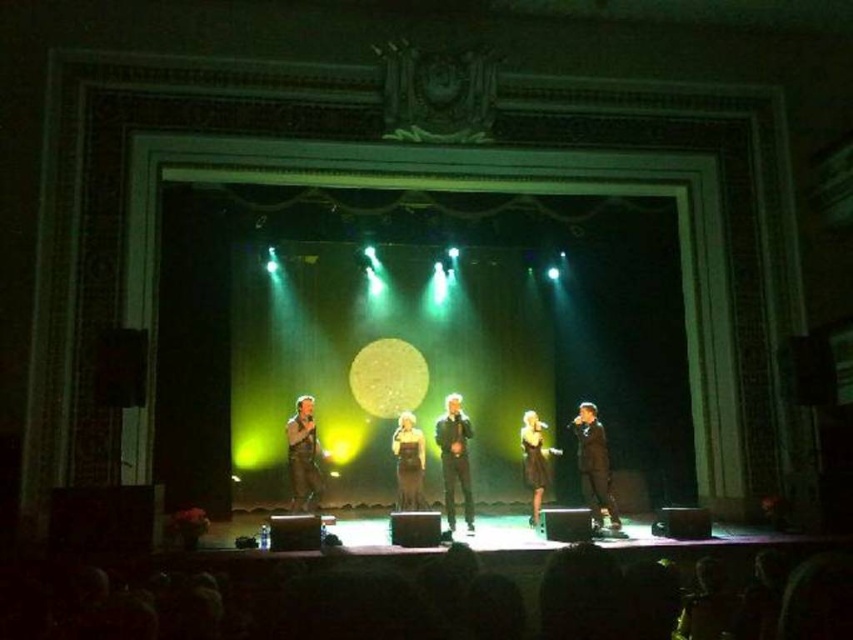
Question: Which object is positioned farthest from the shiny gold dress at center?

Choices:
 (A) shiny brown suit at left
 (B) black matte suit at center
 (C) black leather jacket at center

Answer: (B)

Question: Does black leather jacket at center have a smaller size compared to shiny gold dress at center?

Choices:
 (A) no
 (B) yes

Answer: (A)

Question: Which object appears closest to the camera in this image?

Choices:
 (A) black matte suit at center
 (B) shiny gold dress at center
 (C) shiny brown suit at left
 (D) black leather jacket at center

Answer: (A)

Question: Which point is farther from the camera taking this photo?

Choices:
 (A) (585, 465)
 (B) (471, 525)
 (C) (421, 497)

Answer: (C)

Question: Can you confirm if black leather jacket at center is positioned above shiny gold dress at center?

Choices:
 (A) yes
 (B) no

Answer: (A)

Question: Is black leather jacket at center thinner than shiny gold dress at center?

Choices:
 (A) yes
 (B) no

Answer: (B)